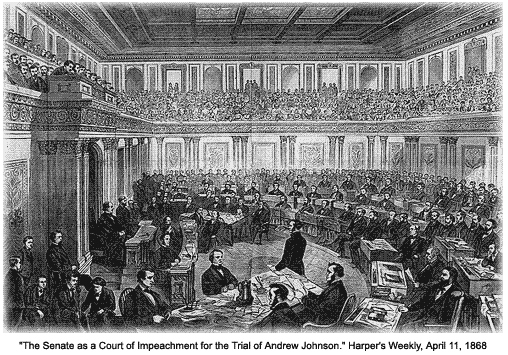
Where is `beam`? The width and height of the screenshot is (508, 355). beam is located at coordinates (74, 199).